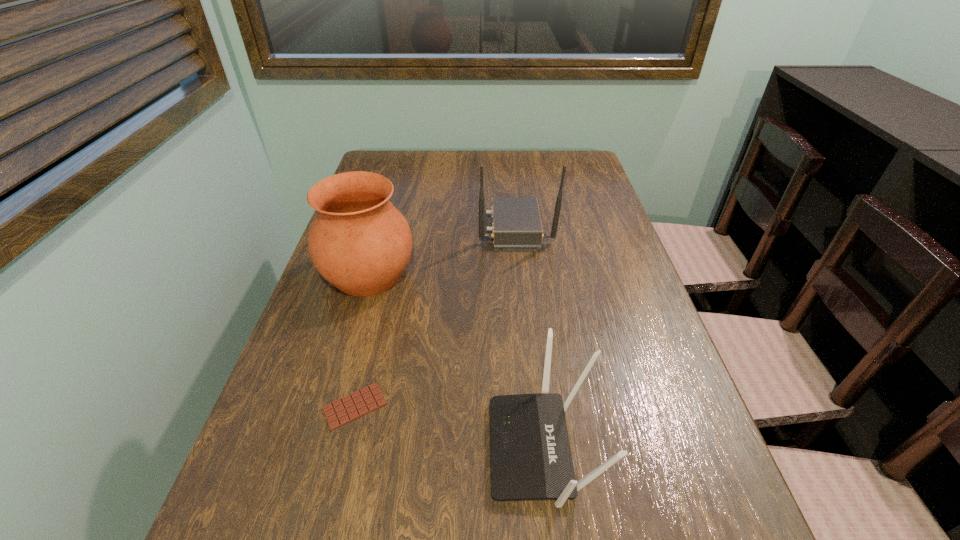
Locate an element on the screen. This screenshot has height=540, width=960. the farther router is located at coordinates (516, 226).

Identify the location of pottery. Image resolution: width=960 pixels, height=540 pixels. (359, 242).

What are the coordinates of `the nearer router` in the screenshot? It's located at (530, 454).

You are a GUI agent. You are given a task and a screenshot of the screen. Output one action in this format:
    pyautogui.click(x=<x>, y=<y>)
    Task: Click on the second shortest object
    Image resolution: width=960 pixels, height=540 pixels.
    Given the screenshot: What is the action you would take?
    pyautogui.click(x=530, y=454)

Find the location of a particular element. The height and width of the screenshot is (540, 960). candy bar is located at coordinates (355, 405).

Where is `vacant point located 0.180m on the back of the taller router to connect cables`? The width and height of the screenshot is (960, 540). vacant point located 0.180m on the back of the taller router to connect cables is located at coordinates (413, 228).

Find the location of a particular element. The width and height of the screenshot is (960, 540). vacant space located on the back of the taller router to connect cables is located at coordinates (344, 228).

At what (x,y) coordinates should I click in order to perform the action: click on free spot located on the back of the taller router to connect cables. Please return your answer as a coordinate pair (x, y). The image size is (960, 540). Looking at the image, I should click on (449, 228).

Locate an element on the screen. vacant space located on the back of the pottery is located at coordinates (390, 202).

You are a GUI agent. You are given a task and a screenshot of the screen. Output one action in this format:
    pyautogui.click(x=<x>, y=<y>)
    Task: Click on the vacant space located on the front-facing side of the nearer router
    The height and width of the screenshot is (540, 960).
    Given the screenshot: What is the action you would take?
    pyautogui.click(x=429, y=448)